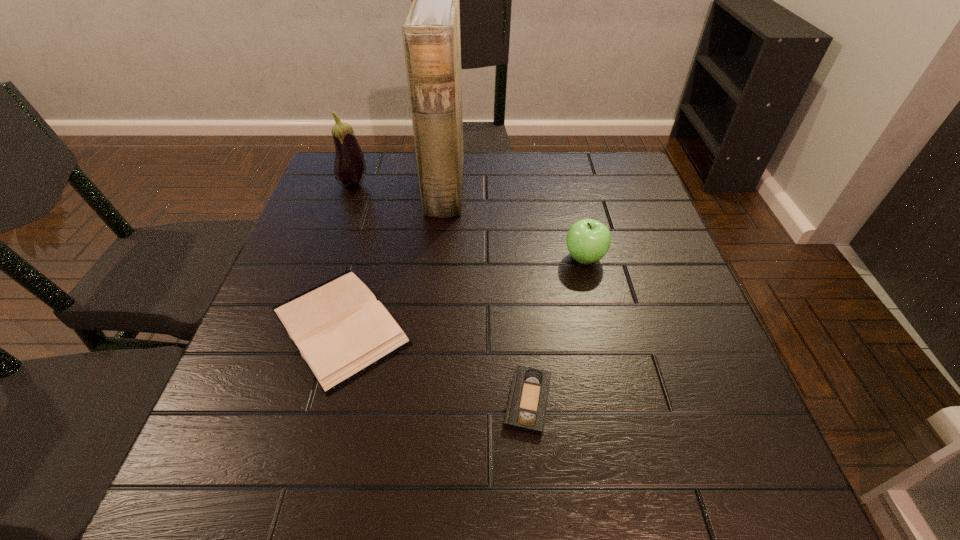
At what (x,y) coordinates should I click in order to perform the action: click on vacant space at the left edge. Please return your answer as a coordinate pair (x, y). The height and width of the screenshot is (540, 960). Looking at the image, I should click on (260, 342).

This screenshot has height=540, width=960. I want to click on vacant region at the right edge of the desktop, so point(656,265).

In the image, there is a desktop. Find the location of `vacant space at the far right corner`. vacant space at the far right corner is located at coordinates (640, 183).

The width and height of the screenshot is (960, 540). Identify the location of free space between the fourth object from left to right and the hardback book. (434, 363).

This screenshot has width=960, height=540. What are the coordinates of `vacant space that is in between the eggplant and the rightmost object` in the screenshot? It's located at 469,221.

Where is `unoccupied position between the shortest object and the third shortest object`? unoccupied position between the shortest object and the third shortest object is located at coordinates (556, 329).

The image size is (960, 540). What are the coordinates of `vacant area that lies between the tallest object and the apple` in the screenshot? It's located at (515, 222).

The image size is (960, 540). Find the location of `free spot between the third shortest object and the eggplant`. free spot between the third shortest object and the eggplant is located at coordinates (469, 221).

Locate an element on the screen. This screenshot has height=540, width=960. unoccupied area between the rightmost object and the hardback book is located at coordinates (462, 292).

I want to click on free space between the shortest object and the apple, so click(556, 329).